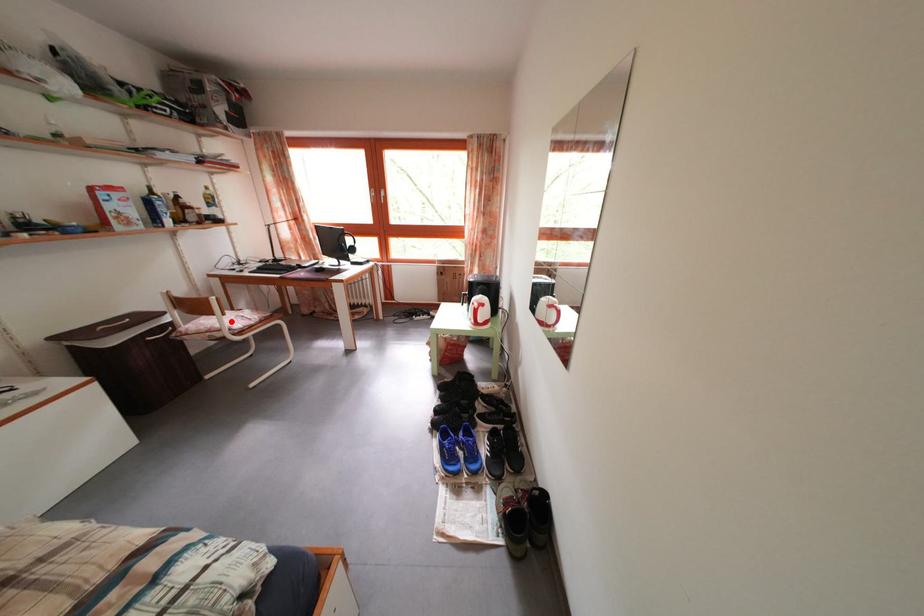
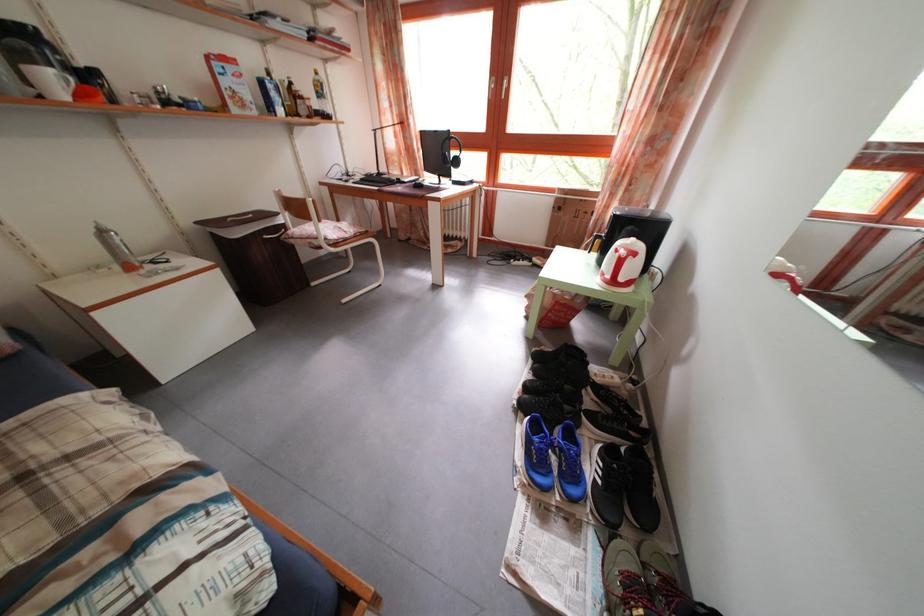
The point at the highlighted location is marked in the first image. Where is the corresponding point in the second image?

(327, 228)